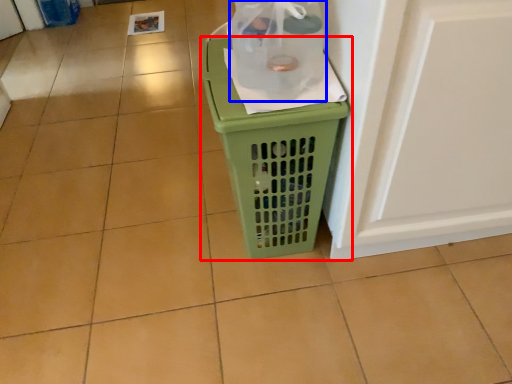
Question: Among these objects, which one is nearest to the camera, waste container (highlighted by a red box) or bottle (highlighted by a blue box)?

Choices:
 (A) waste container
 (B) bottle

Answer: (B)